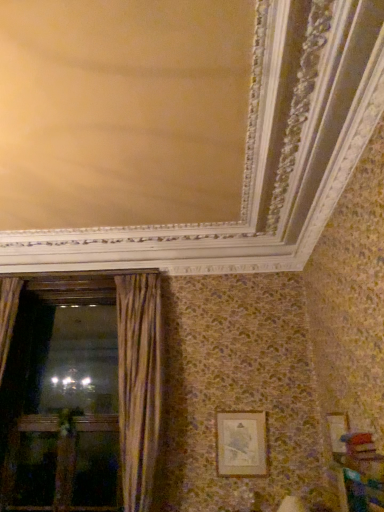
Question: Considering the relative sizes of gold textured curtain at left and wooden screen door at left in the image provided, is gold textured curtain at left shorter than wooden screen door at left?

Choices:
 (A) no
 (B) yes

Answer: (A)

Question: Would you say wooden screen door at left is part of gold textured curtain at left's contents?

Choices:
 (A) no
 (B) yes

Answer: (A)

Question: Is gold textured curtain at left turned away from wooden screen door at left?

Choices:
 (A) no
 (B) yes

Answer: (A)

Question: Is gold textured curtain at left taller than wooden screen door at left?

Choices:
 (A) yes
 (B) no

Answer: (A)

Question: From a real-world perspective, is gold textured curtain at left located higher than wooden screen door at left?

Choices:
 (A) no
 (B) yes

Answer: (B)

Question: Is the depth of gold textured curtain at left less than that of wooden screen door at left?

Choices:
 (A) no
 (B) yes

Answer: (B)

Question: Does gold textured frame at lower right have a lesser width compared to wooden screen door at left?

Choices:
 (A) yes
 (B) no

Answer: (A)

Question: From a real-world perspective, is gold textured frame at lower right beneath wooden screen door at left?

Choices:
 (A) no
 (B) yes

Answer: (A)

Question: From the image's perspective, is gold textured frame at lower right under wooden screen door at left?

Choices:
 (A) no
 (B) yes

Answer: (A)

Question: Is gold textured frame at lower right positioned beyond the bounds of wooden screen door at left?

Choices:
 (A) yes
 (B) no

Answer: (A)

Question: Is gold textured frame at lower right facing towards wooden screen door at left?

Choices:
 (A) yes
 (B) no

Answer: (B)

Question: From the image's perspective, is gold textured frame at lower right on top of wooden screen door at left?

Choices:
 (A) no
 (B) yes

Answer: (B)

Question: Is gold textured curtain at left turned away from wooden cabinet at lower right?

Choices:
 (A) no
 (B) yes

Answer: (A)